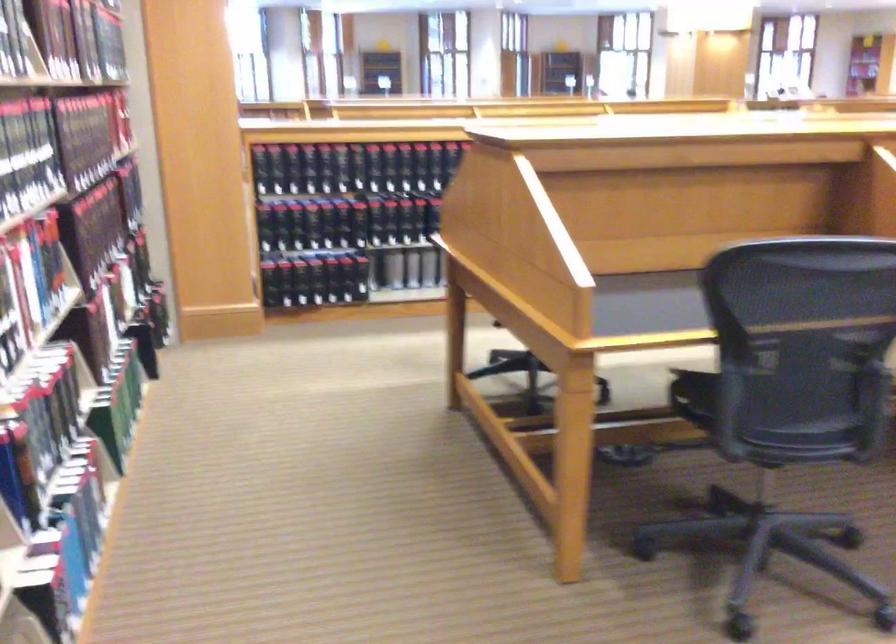
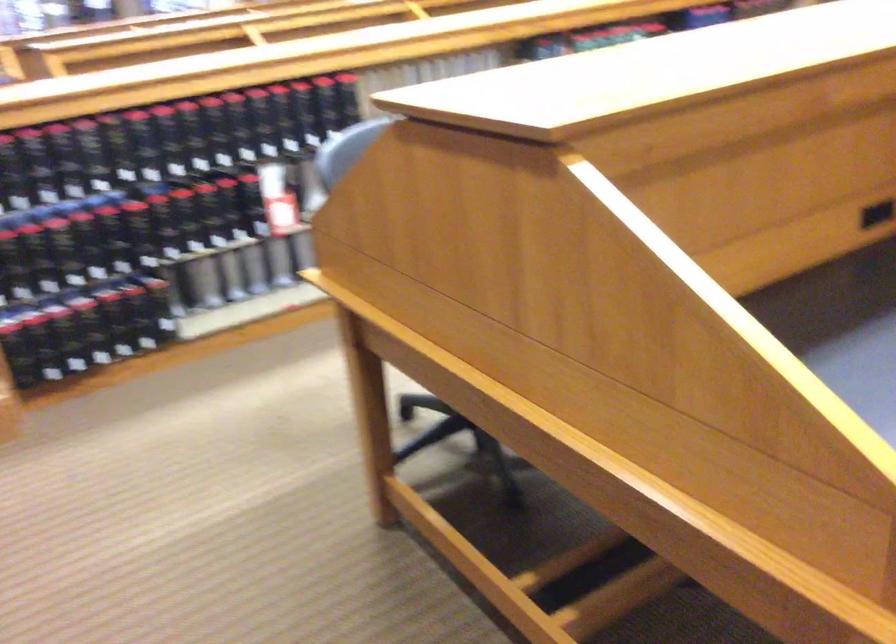
In the second image, find the point that corresponds to (x=383, y=162) in the first image.

(165, 142)